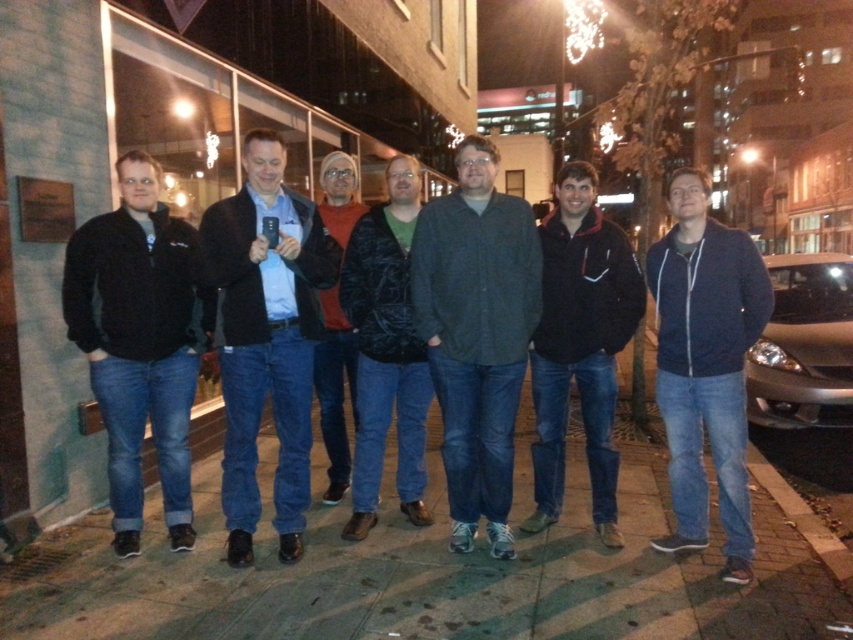
Question: Does dark blue zip-up jacket at center appear under black fleece jacket at center?

Choices:
 (A) no
 (B) yes

Answer: (B)

Question: Can you confirm if black matte jacket at center is positioned above dark gray textured jacket at center?

Choices:
 (A) yes
 (B) no

Answer: (A)

Question: Which point is farther from the camera taking this photo?

Choices:
 (A) (x=651, y=636)
 (B) (x=618, y=456)

Answer: (B)

Question: Does black fleece jacket at left have a smaller size compared to dark gray textured jacket at center?

Choices:
 (A) no
 (B) yes

Answer: (A)

Question: Which of the following is the farthest from the observer?

Choices:
 (A) dark gray shirt at center
 (B) smooth concrete pavement at center
 (C) dark green textured jacket at center

Answer: (C)

Question: Among these objects, which one is nearest to the camera?

Choices:
 (A) dark blue zip-up jacket at center
 (B) smooth concrete pavement at center
 (C) dark gray textured jacket at center
 (D) black fleece jacket at center

Answer: (B)